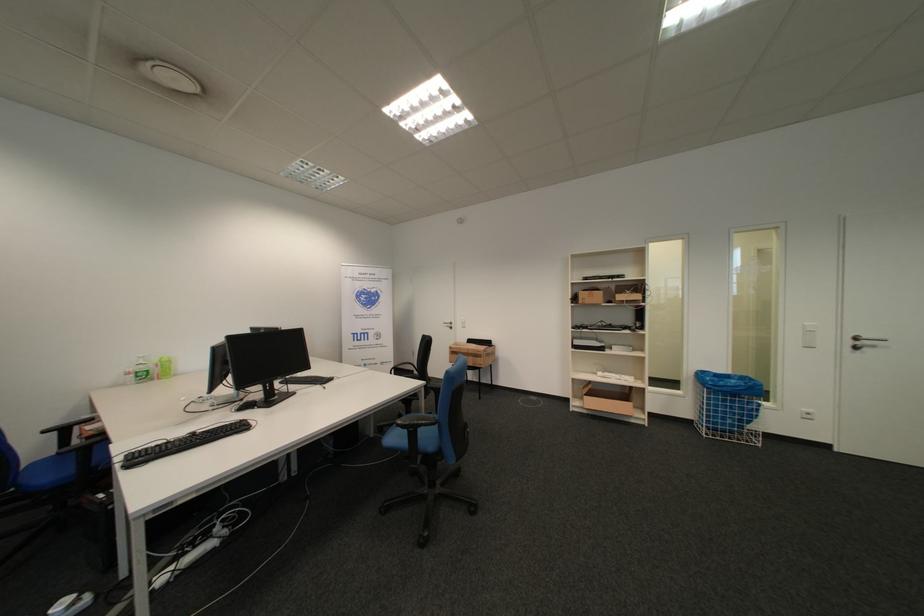
Describe the element at coordinates (46, 472) in the screenshot. Image resolution: width=924 pixels, height=616 pixels. I see `the blue chair sitting surface` at that location.